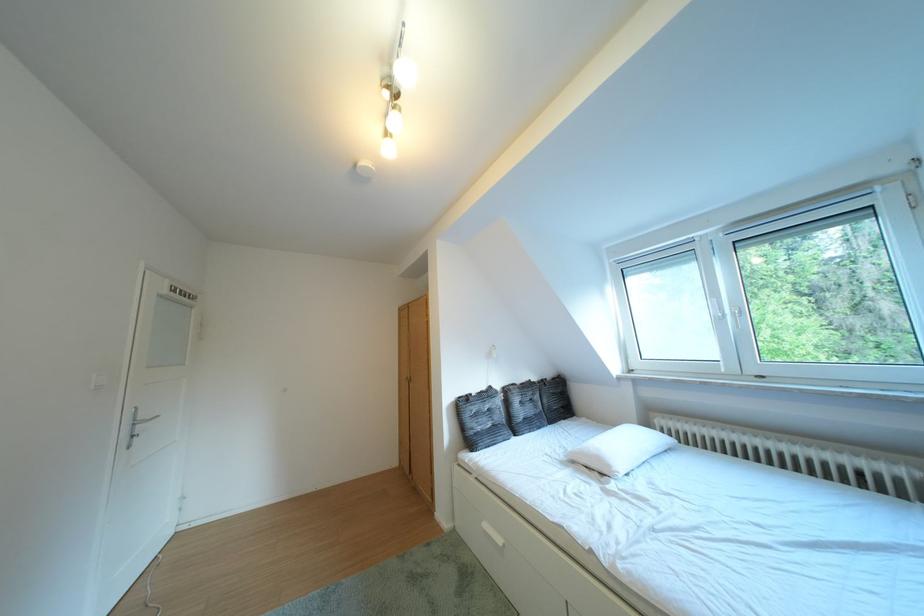
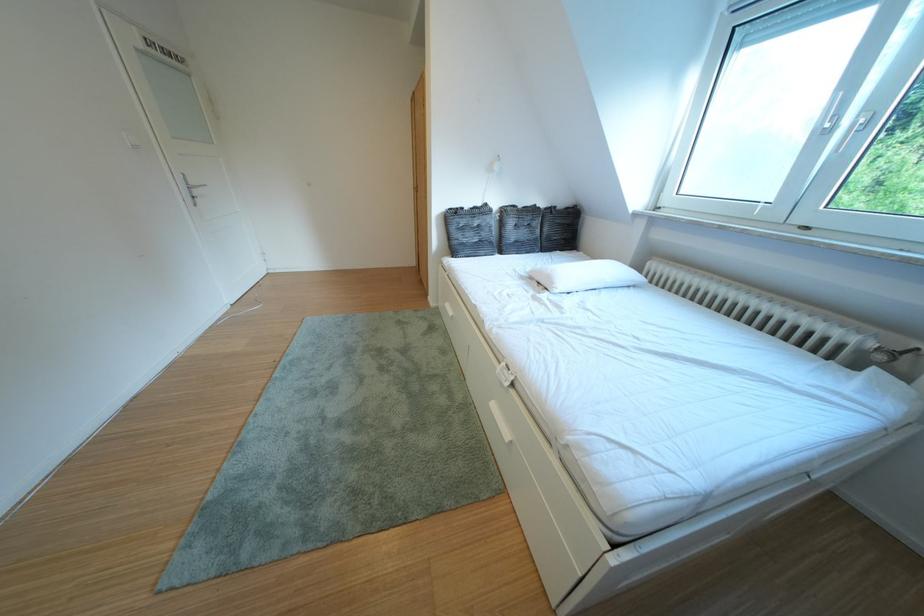
Where in the second image is the point corresponding to the point at 484,438 from the first image?

(468, 246)